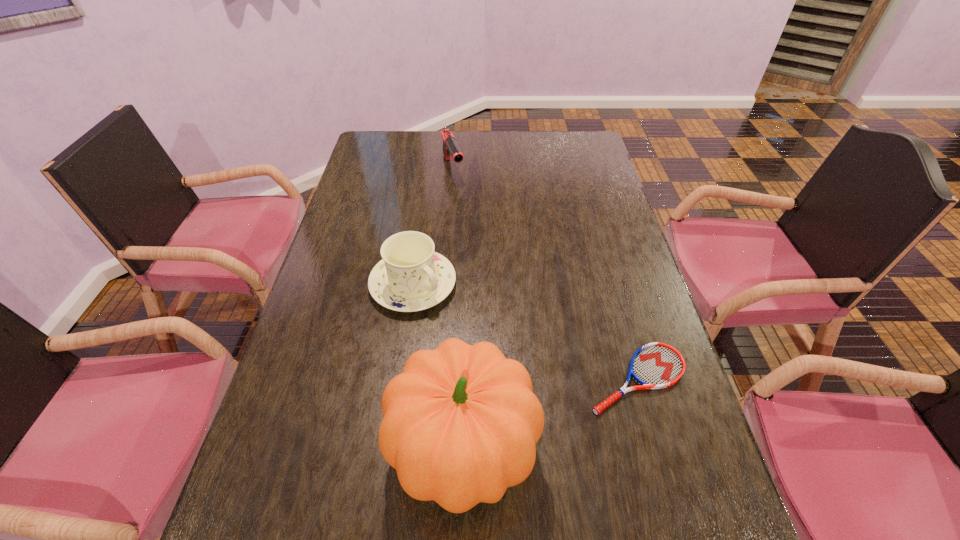
Image resolution: width=960 pixels, height=540 pixels. Find the location of `free space located 0.360m on the handle side of the second farthest object`. free space located 0.360m on the handle side of the second farthest object is located at coordinates (x=543, y=401).

I want to click on vacant space located on the handle side of the second farthest object, so click(x=540, y=399).

What are the coordinates of `vacant space located 0.060m on the handle side of the second farthest object` in the screenshot? It's located at (455, 322).

The image size is (960, 540). In order to click on object situated at the far edge in this screenshot , I will do `click(450, 147)`.

Image resolution: width=960 pixels, height=540 pixels. Find the location of `object positioned at the near edge`. object positioned at the near edge is located at coordinates (460, 425).

Locate an element on the screen. object that is at the left edge is located at coordinates (411, 277).

Locate an element on the screen. The height and width of the screenshot is (540, 960). object that is at the right edge is located at coordinates (656, 365).

The height and width of the screenshot is (540, 960). Find the location of `vacant space at the far edge of the desktop`. vacant space at the far edge of the desktop is located at coordinates (508, 137).

I want to click on vacant space at the near edge, so click(527, 479).

Image resolution: width=960 pixels, height=540 pixels. I want to click on free region at the left edge, so click(371, 188).